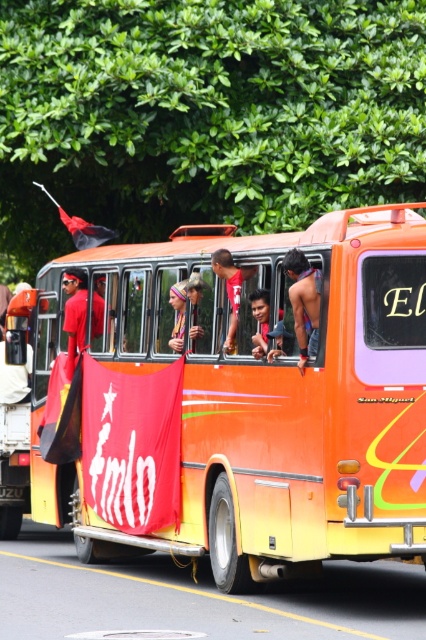
You are a photographer trying to capture a clear shot of the skinny man at center and the red fabric flag at left. Based on their positions, which object should you focus on first to ensure both are in frame?

The skinny man at center is positioned on the right side of red fabric flag at left. To ensure both are in frame, focus on the red fabric flag at left first since it is to the left of the skinny man at center.

In the scene shown: You are a photographer trying to capture a clear shot of both the red fabric flag at left and the matte purple headscarf at center. Based on their positions, which object is lower in the image?

The red fabric flag at left is located below matte purple headscarf at center, so the red fabric flag at left is lower in the image.